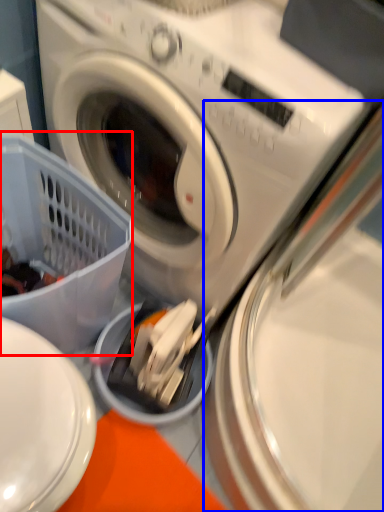
Question: Which object is further to the camera taking this photo, basket (highlighted by a red box) or washing machine (highlighted by a blue box)?

Choices:
 (A) basket
 (B) washing machine

Answer: (B)